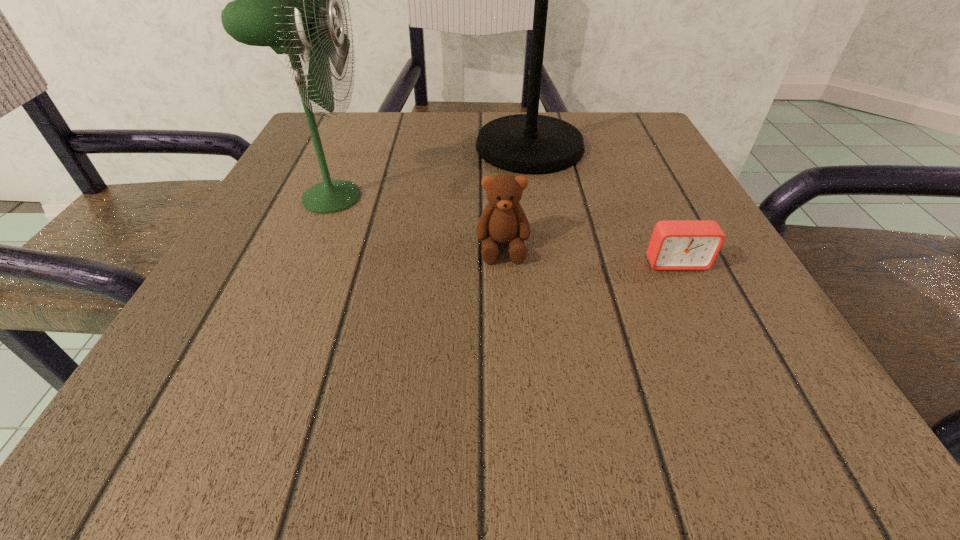
Where is `the tallest object`? the tallest object is located at coordinates (529, 143).

Where is `the third shortest object`? This screenshot has height=540, width=960. the third shortest object is located at coordinates (283, 0).

The width and height of the screenshot is (960, 540). I want to click on the leftmost object, so click(283, 0).

Image resolution: width=960 pixels, height=540 pixels. I want to click on the second shortest object, so click(x=503, y=221).

Find the location of `the rightmost object`. the rightmost object is located at coordinates (675, 244).

Find the location of a particular element. the shortest object is located at coordinates (675, 244).

Identify the location of free space located 0.220m on the front of the table lamp. The height and width of the screenshot is (540, 960). (548, 258).

Where is `vacant region located on the front-facing side of the fan`? This screenshot has height=540, width=960. vacant region located on the front-facing side of the fan is located at coordinates (559, 197).

Image resolution: width=960 pixels, height=540 pixels. In order to click on free space located 0.150m on the face of the third tallest object in this screenshot , I will do `click(509, 352)`.

The height and width of the screenshot is (540, 960). I want to click on free space located on the front-facing side of the shortest object, so click(726, 368).